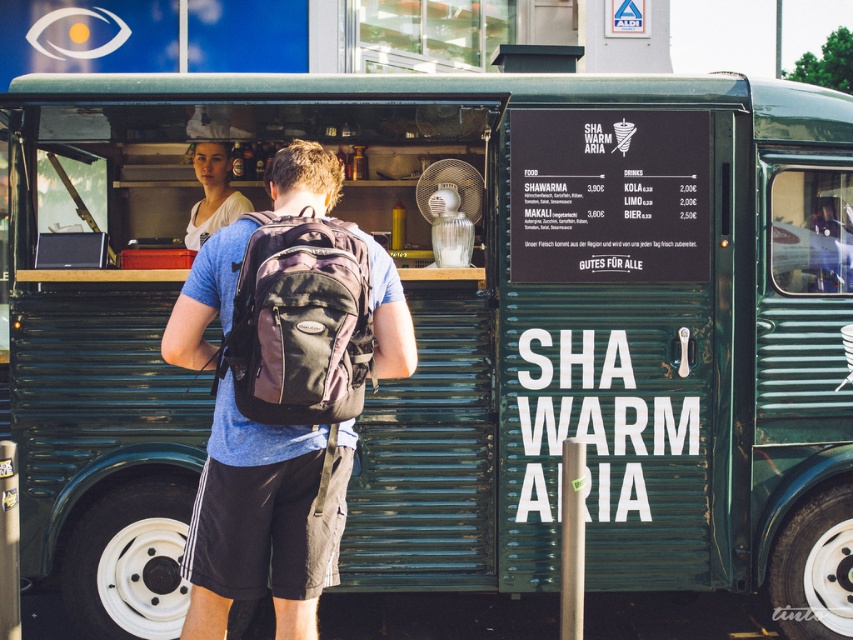
Does blue cotton t-shirt at center appear under light brown hair at upper center?

Yes.

Which of these two, blue cotton t-shirt at center or light brown hair at upper center, stands shorter?

With less height is blue cotton t-shirt at center.

Is point (397, 317) farther from viewer compared to point (207, 161)?

No, (397, 317) is in front of (207, 161).

Identify the location of blue cotton t-shirt at center. The width and height of the screenshot is (853, 640). (189, 333).